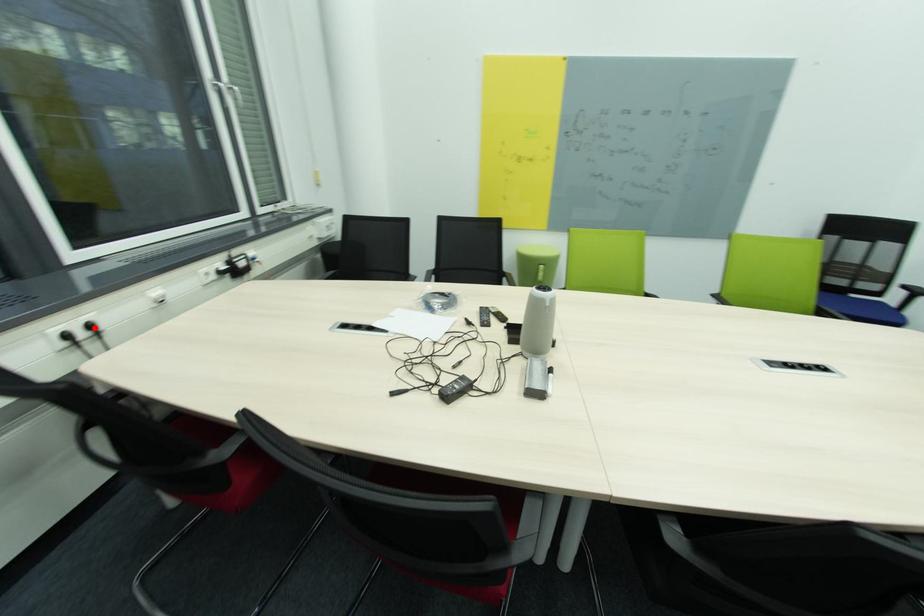
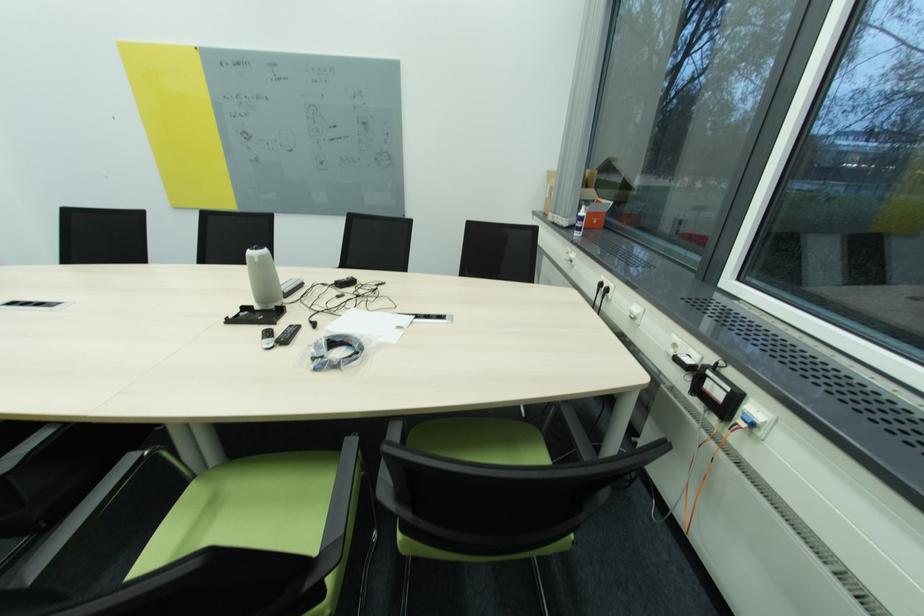
The point at the highlighted location is marked in the first image. Where is the corresponding point in the second image?

(612, 291)